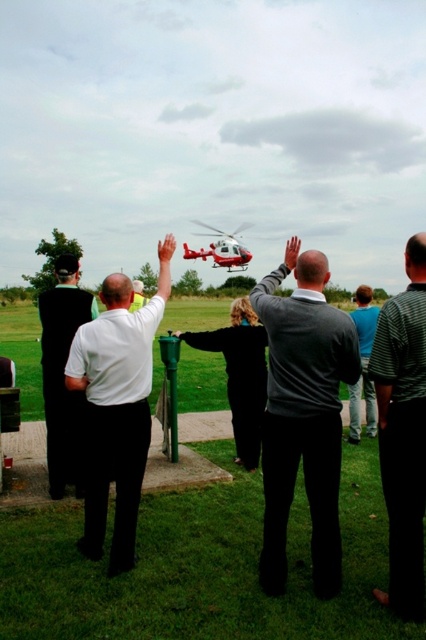
Question: Is black matte suit at left below blue cotton shirt at center?

Choices:
 (A) no
 (B) yes

Answer: (B)

Question: Based on their relative distances, which object is nearer to the red glossy helicopter at center?

Choices:
 (A) black matte suit at left
 (B) white matte shirt at center

Answer: (A)

Question: Which point is closer to the camera?

Choices:
 (A) white matte shirt at center
 (B) blue cotton shirt at center

Answer: (A)

Question: Is striped shirt at center thinner than blue cotton shirt at center?

Choices:
 (A) yes
 (B) no

Answer: (B)

Question: Is striped shirt at center below blue cotton shirt at center?

Choices:
 (A) yes
 (B) no

Answer: (A)

Question: Among these objects, which one is nearest to the camera?

Choices:
 (A) striped shirt at center
 (B) black matte suit at left
 (C) white matte shirt at center
 (D) blue cotton shirt at center

Answer: (A)